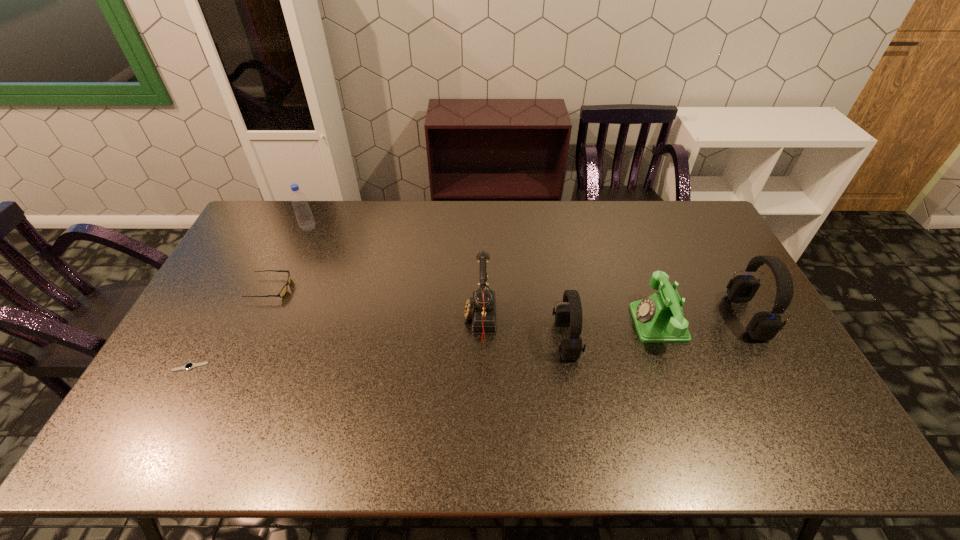
The image size is (960, 540). Find the location of `the shorter headset`. the shorter headset is located at coordinates (567, 315).

Find the location of a particular element. The width and height of the screenshot is (960, 540). the left headset is located at coordinates (567, 315).

Find the location of `the rightmost object`. the rightmost object is located at coordinates (764, 326).

Where is `the taller headset`? This screenshot has height=540, width=960. the taller headset is located at coordinates pyautogui.click(x=764, y=326).

This screenshot has height=540, width=960. What are the coordinates of `the farthest object` in the screenshot? It's located at (306, 222).

The width and height of the screenshot is (960, 540). In order to click on the second shortest object in this screenshot , I will do `click(283, 291)`.

Find the location of a particular element. the third shortest object is located at coordinates (659, 318).

Where is `the right telephone`? the right telephone is located at coordinates (659, 318).

Locate an element on the screen. This screenshot has height=540, width=960. the leftmost object is located at coordinates (190, 365).

You are a GUI agent. You are given a task and a screenshot of the screen. Output one action in this format:
    pyautogui.click(x=<x>, y=<y>)
    Task: Click on the watch
    This screenshot has height=540, width=960.
    Given the screenshot: What is the action you would take?
    pyautogui.click(x=190, y=365)